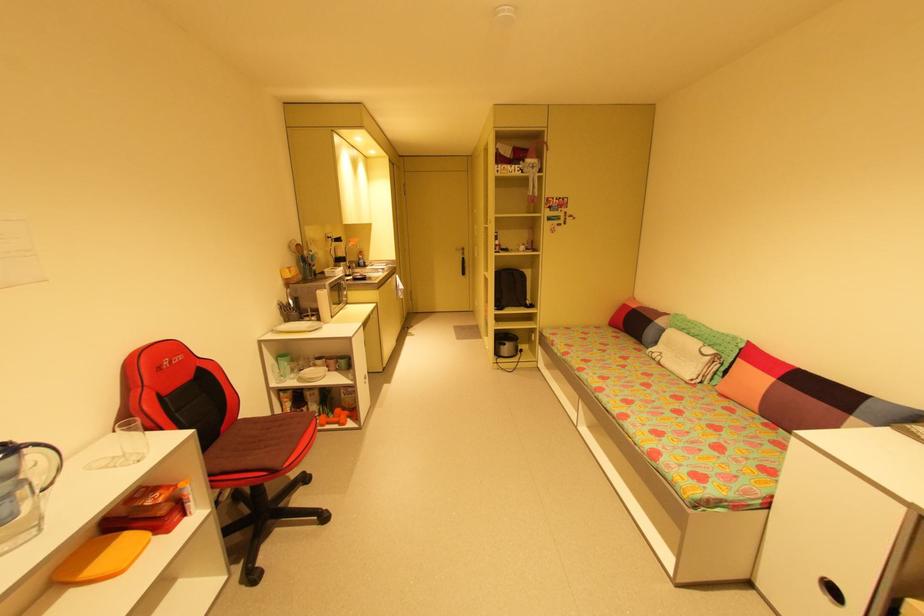
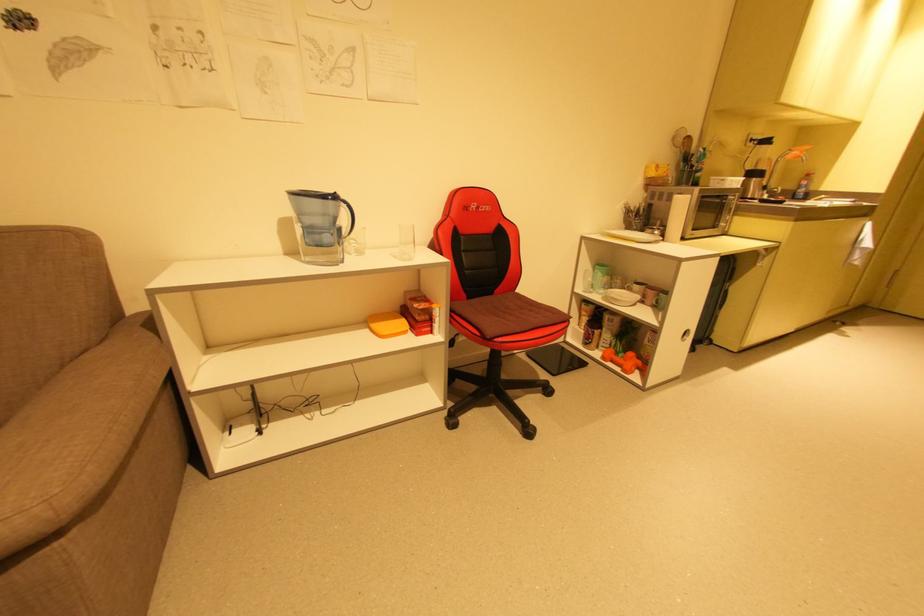
From the picture: The first image is from the beginning of the video and the second image is from the end. How did the camera likely rotate when shooting the video?

The rotation direction of the camera is left-down.